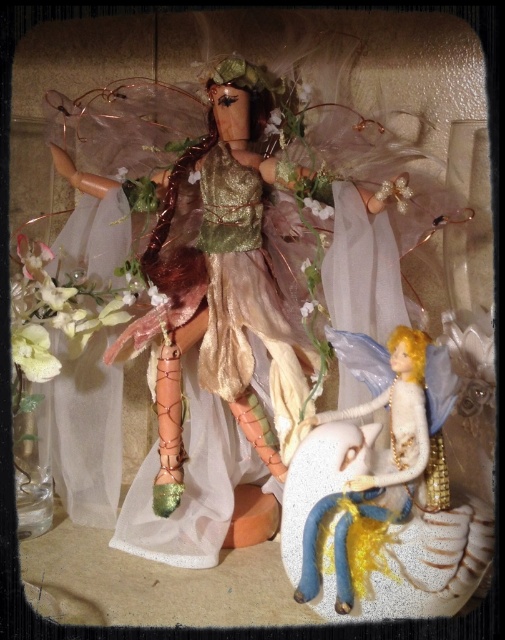
Question: Can you confirm if shiny gold fabric dress at center is positioned above blue fabric unicorn at lower center?

Choices:
 (A) no
 (B) yes

Answer: (B)

Question: Does shiny gold fabric dress at center appear on the left side of blue fabric unicorn at lower center?

Choices:
 (A) no
 (B) yes

Answer: (B)

Question: Does shiny gold fabric dress at center lie behind blue fabric unicorn at lower center?

Choices:
 (A) no
 (B) yes

Answer: (B)